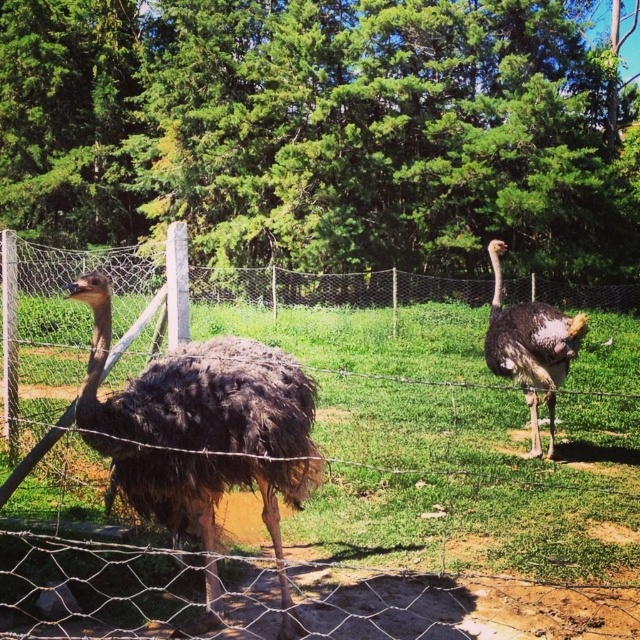
Question: Which point appears farthest from the camera in this image?

Choices:
 (A) (534, 289)
 (B) (192, 380)
 (C) (490, 369)

Answer: (A)

Question: Is brown feathered ostrich at left smaller than wire mesh fence at center?

Choices:
 (A) yes
 (B) no

Answer: (A)

Question: Can you confirm if wire mesh fence at center is wider than dark brown feathered ostrich at right?

Choices:
 (A) no
 (B) yes

Answer: (B)

Question: Which object is positioned closest to the dark brown feathered ostrich at right?

Choices:
 (A) brown feathered ostrich at left
 (B) wire mesh fence at center

Answer: (A)

Question: Among these objects, which one is nearest to the camera?

Choices:
 (A) wire mesh fence at center
 (B) brown feathered ostrich at left
 (C) dark brown feathered ostrich at right

Answer: (B)

Question: Observing the image, what is the correct spatial positioning of wire mesh fence at center in reference to dark brown feathered ostrich at right?

Choices:
 (A) left
 (B) right

Answer: (A)